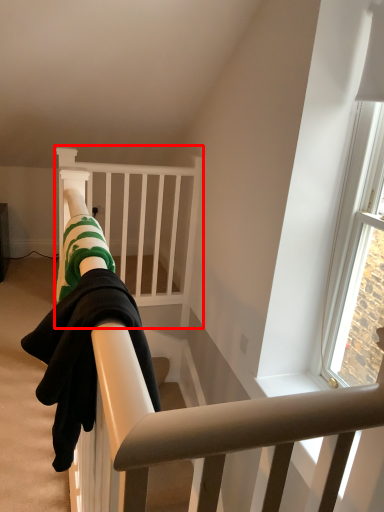
Question: In this image, where is infant bed (annotated by the red box) located relative to person?

Choices:
 (A) left
 (B) right

Answer: (A)